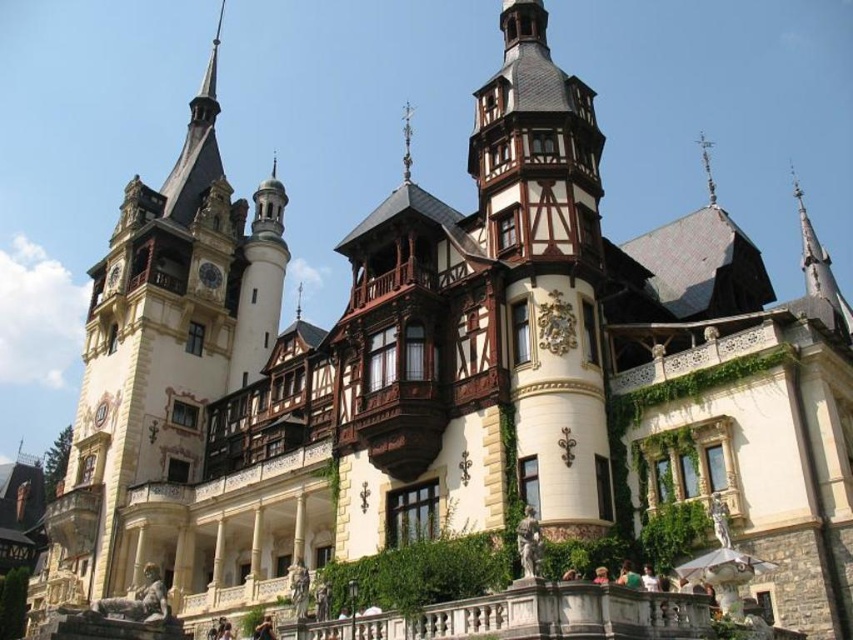
Is wooden clock tower at left smaller than matte black clock at upper center?

No, wooden clock tower at left is not smaller than matte black clock at upper center.

Between point (274, 304) and point (210, 278), which one is positioned in front?

Point (210, 278) is more forward.

Where is `wooden clock tower at left`? The height and width of the screenshot is (640, 853). wooden clock tower at left is located at coordinates (161, 369).